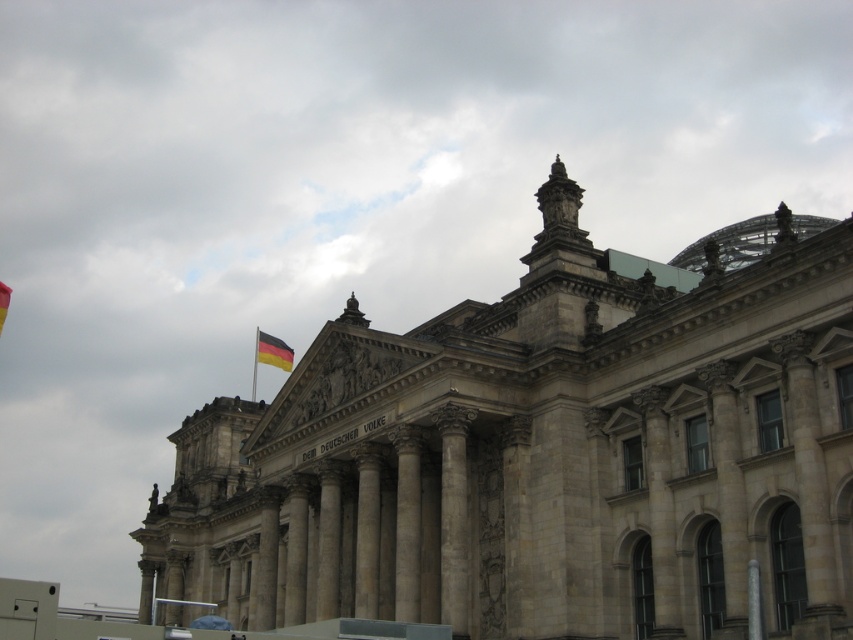
Is german flag at center wider than red fabric flag at left?

No, german flag at center is not wider than red fabric flag at left.

Between german flag at center and red fabric flag at left, which one appears on the left side from the viewer's perspective?

red fabric flag at left is more to the left.

Which is behind, point (283, 349) or point (3, 300)?

Positioned behind is point (3, 300).

What are the coordinates of `german flag at center` in the screenshot? It's located at (273, 352).

Which is more to the right, red fabric flag at left or metallic flag pole at upper center?

Positioned to the right is metallic flag pole at upper center.

Which is in front, point (9, 291) or point (256, 348)?

Point (9, 291) is in front.

Is point (3, 291) closer to camera compared to point (257, 346)?

No, (3, 291) is further to viewer.

The image size is (853, 640). Identify the location of red fabric flag at left. (3, 301).

Is german flag at center bigger than metallic flag pole at upper center?

Incorrect, german flag at center is not larger than metallic flag pole at upper center.

Who is more forward, (270,348) or (254,374)?

Point (270,348)

The height and width of the screenshot is (640, 853). I want to click on german flag at center, so click(x=273, y=352).